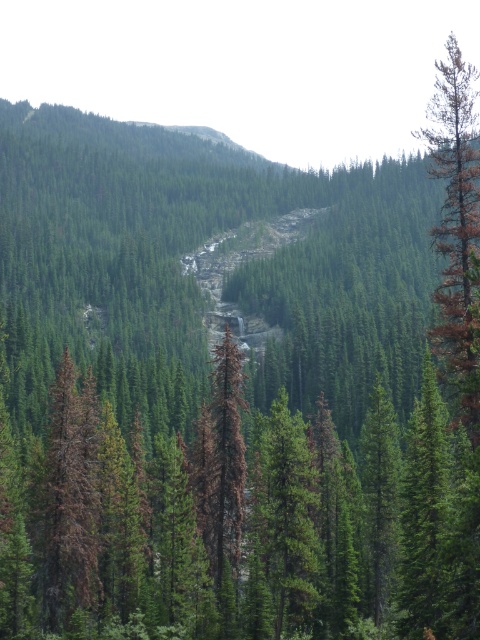
Question: Does brown/dried wood tree at right lie in front of brown/dried wood tree at left?

Choices:
 (A) no
 (B) yes

Answer: (B)

Question: Can you confirm if brown/dried wood tree at right is thinner than brown/dried wood tree at left?

Choices:
 (A) yes
 (B) no

Answer: (B)

Question: Considering the real-world distances, which object is closest to the green matte tree at center?

Choices:
 (A) brown/dried wood tree at left
 (B) brown/dried wood tree at right

Answer: (A)

Question: Which point is closer to the camera?

Choices:
 (A) brown/dried wood tree at left
 (B) brown/dried wood tree at right
 (C) green matte tree at center

Answer: (B)

Question: Which of the following is the closest to the observer?

Choices:
 (A) brown/dried wood tree at left
 (B) green matte tree at center

Answer: (B)

Question: Where is brown/dried wood tree at left located in relation to green matte tree at center in the image?

Choices:
 (A) below
 (B) above

Answer: (B)